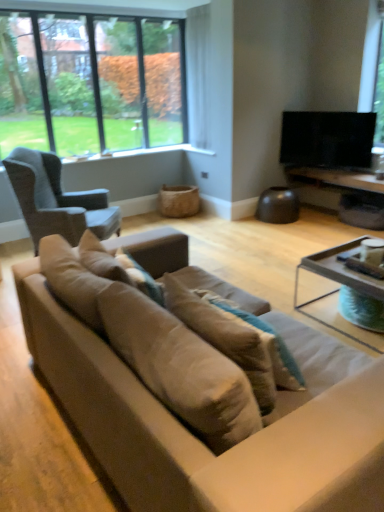
Question: Is suede couch at center further to the viewer compared to clear glass window at upper left?

Choices:
 (A) no
 (B) yes

Answer: (A)

Question: Would you say suede couch at center contains clear glass window at upper left?

Choices:
 (A) yes
 (B) no

Answer: (B)

Question: Considering the relative sizes of suede couch at center and clear glass window at upper left in the image provided, is suede couch at center smaller than clear glass window at upper left?

Choices:
 (A) no
 (B) yes

Answer: (A)

Question: Can you confirm if suede couch at center is positioned to the right of clear glass window at upper left?

Choices:
 (A) no
 (B) yes

Answer: (B)

Question: Are suede couch at center and clear glass window at upper left far apart?

Choices:
 (A) yes
 (B) no

Answer: (A)

Question: Would you say suede couch at center is outside clear glass window at upper left?

Choices:
 (A) no
 (B) yes

Answer: (B)

Question: From a real-world perspective, is wooden tray at lower right over suede-like beige pillow at center, acting as the 2th pillow starting from the right?

Choices:
 (A) yes
 (B) no

Answer: (B)

Question: Can you confirm if wooden tray at lower right is thinner than suede-like beige pillow at center, acting as the 2th pillow starting from the right?

Choices:
 (A) yes
 (B) no

Answer: (B)

Question: From the image's perspective, does wooden tray at lower right appear higher than suede-like beige pillow at center, acting as the 2th pillow starting from the right?

Choices:
 (A) no
 (B) yes

Answer: (B)

Question: Would you say wooden tray at lower right is a long distance from suede-like beige pillow at center, acting as the 1th pillow starting from the left?

Choices:
 (A) no
 (B) yes

Answer: (B)

Question: Can you confirm if wooden tray at lower right is wider than suede-like beige pillow at center, acting as the 2th pillow starting from the right?

Choices:
 (A) no
 (B) yes

Answer: (B)

Question: Does wooden tray at lower right lie behind suede-like beige pillow at center, acting as the 1th pillow starting from the left?

Choices:
 (A) no
 (B) yes

Answer: (B)

Question: Considering the relative sizes of suede-like beige pillow at center, acting as the 2th pillow starting from the right, and black glossy tv at upper right in the image provided, is suede-like beige pillow at center, acting as the 2th pillow starting from the right, taller than black glossy tv at upper right?

Choices:
 (A) yes
 (B) no

Answer: (B)